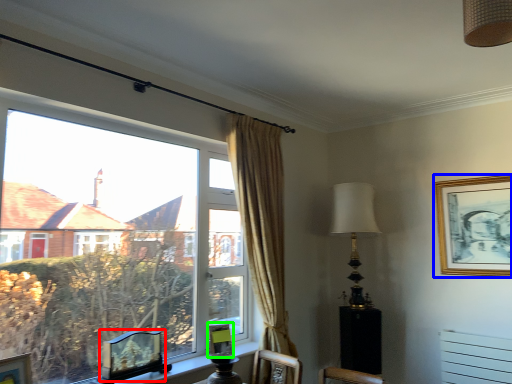
Question: Which object is positioned farthest from picture frame (highlighted by a red box)? Select from picture frame (highlighted by a blue box) and picture frame (highlighted by a green box).

Choices:
 (A) picture frame
 (B) picture frame

Answer: (A)